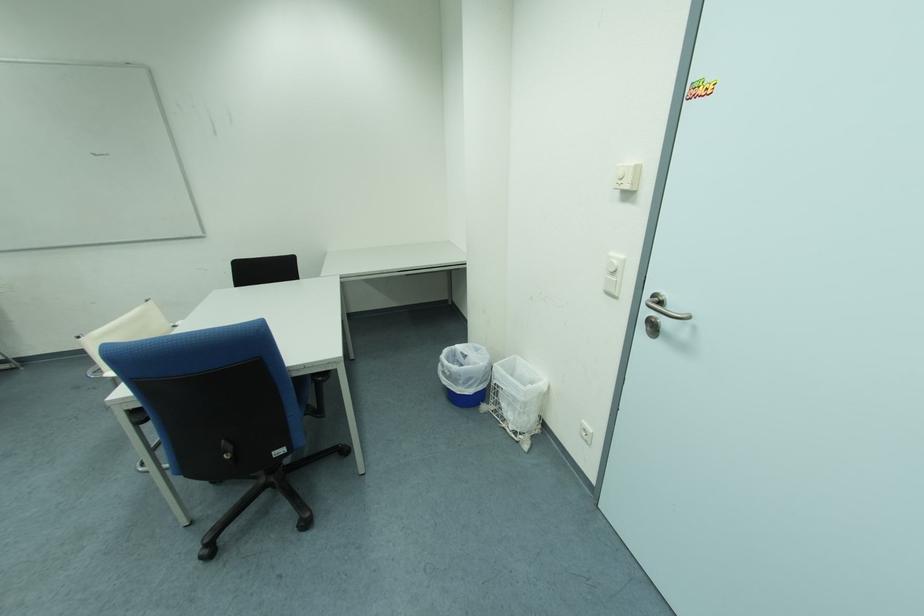
Locate an element on the screen. thermostat dial is located at coordinates (626, 176).